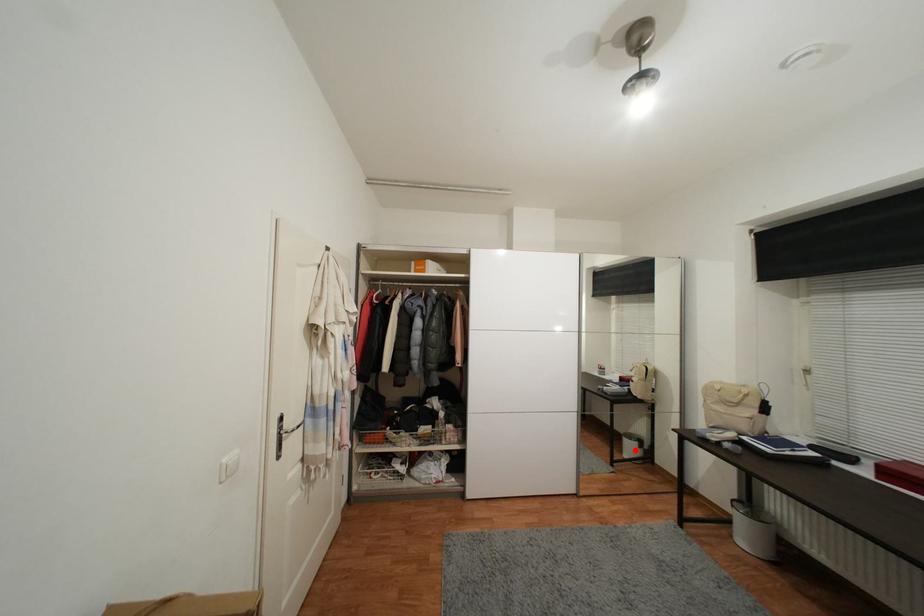
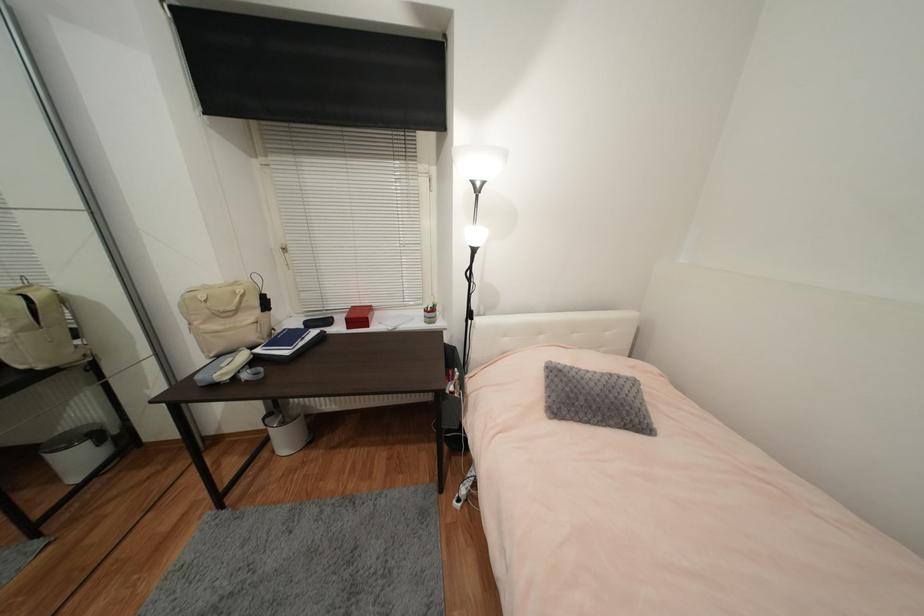
Question: I am providing you with two images of the same scene from different viewpoints. Image1 has a red point marked. In image2, the corresponding 3D location appears at what relative position? Reply with the corresponding letter.

Choices:
 (A) Closer
 (B) Farther

Answer: (A)